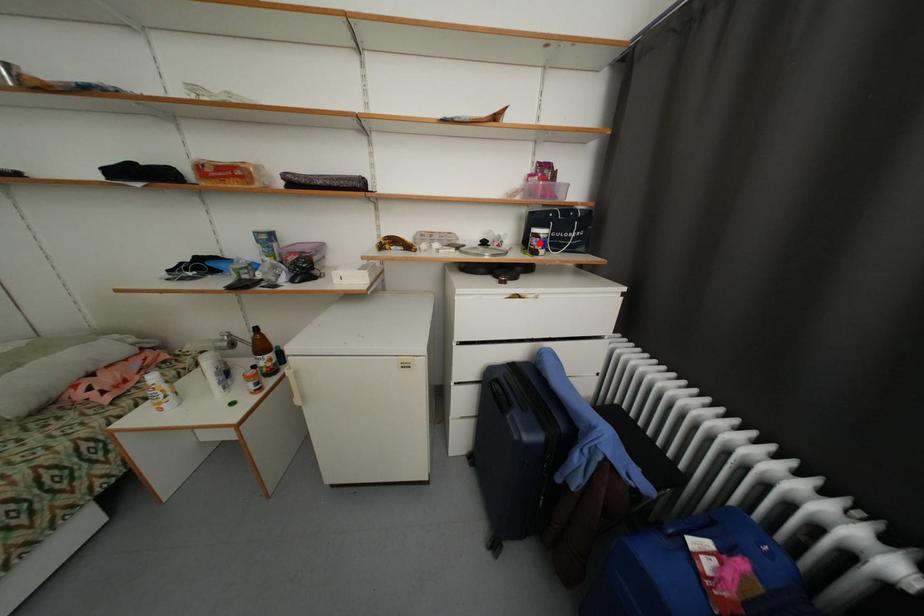
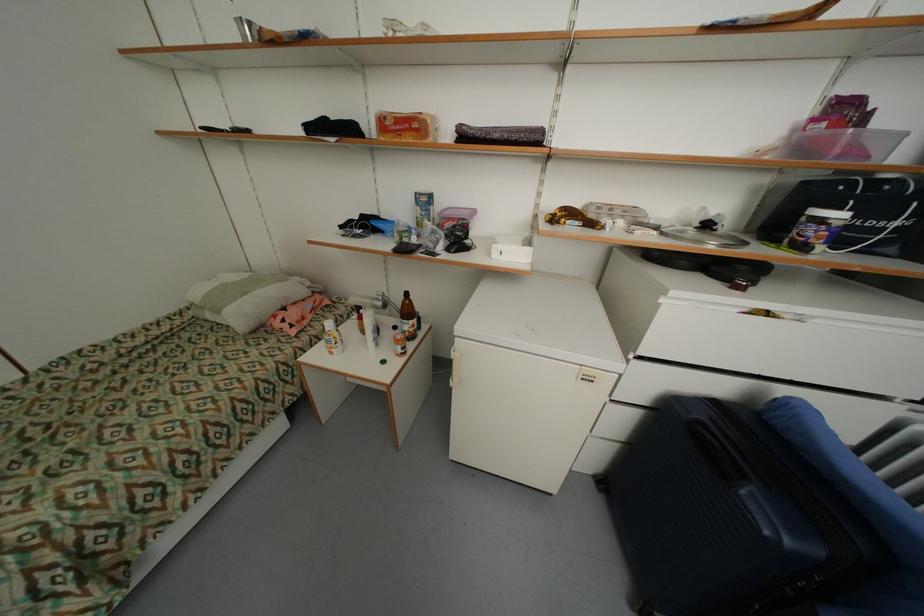
Find the pixel in the second image that matches the highlighted location in the first image.

(819, 233)